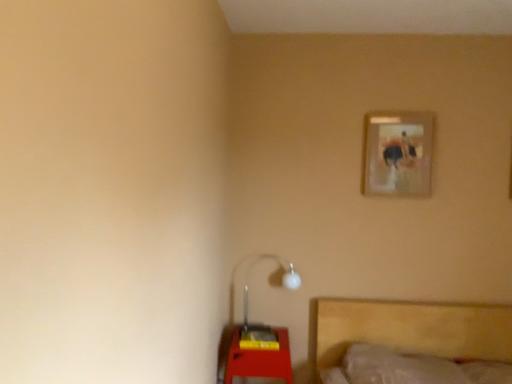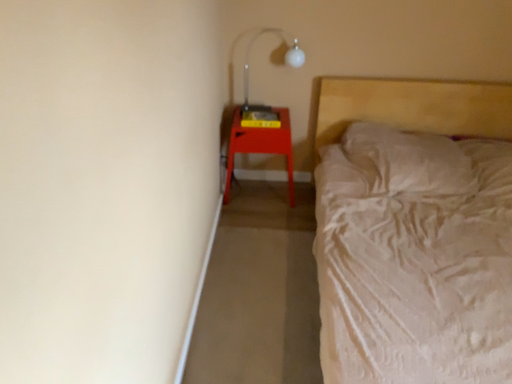
Question: How did the camera likely rotate when shooting the video?

Choices:
 (A) rotated downward
 (B) rotated upward

Answer: (A)